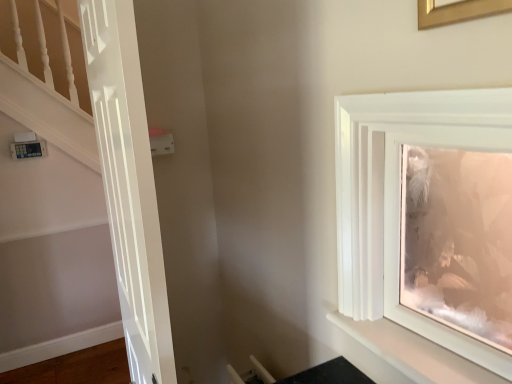
Locate an element on the screen. The height and width of the screenshot is (384, 512). free space underneath white glossy frame at upper right (from a real-world perspective) is located at coordinates point(411,354).